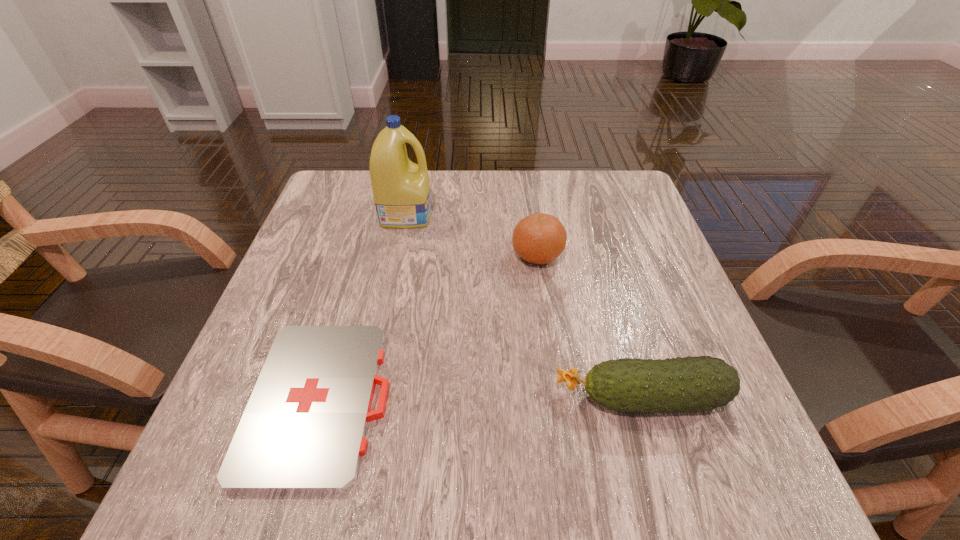
At what (x,y) coordinates should I click in order to perform the action: click on free region at the near right corner of the desktop. Please return your answer as a coordinate pair (x, y). This screenshot has height=540, width=960. Looking at the image, I should click on (745, 459).

Where is `unoccupied position between the cucumber and the first-aid kit`? unoccupied position between the cucumber and the first-aid kit is located at coordinates (481, 399).

In order to click on unoccupied area between the clementine and the cucumber in this screenshot , I will do `click(589, 326)`.

Locate an element on the screen. This screenshot has width=960, height=540. unoccupied area between the tallest object and the clementine is located at coordinates (471, 234).

Find the location of `vacant space in between the clementine and the first-aid kit`. vacant space in between the clementine and the first-aid kit is located at coordinates (429, 328).

This screenshot has width=960, height=540. I want to click on vacant area that lies between the shortest object and the clementine, so click(x=429, y=328).

This screenshot has width=960, height=540. Identify the location of vacant region between the tallest object and the shortest object. (364, 307).

Image resolution: width=960 pixels, height=540 pixels. Find the location of `vacant space in between the clementine and the detergent`. vacant space in between the clementine and the detergent is located at coordinates (471, 234).

Identify the location of free spot between the detergent and the second farthest object. This screenshot has width=960, height=540. (471, 234).

Locate an element on the screen. vacant area that lies between the second farthest object and the first-aid kit is located at coordinates (429, 328).